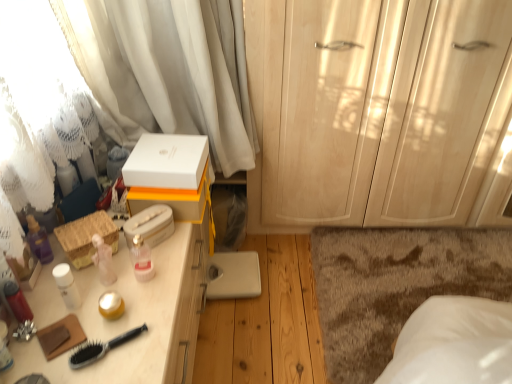
Locate an element on the screen. free area in between white matte tissue box at upper center, arranged as the second storage box when ordered from the bottom, and black plastic brush at lower left is located at coordinates (131, 284).